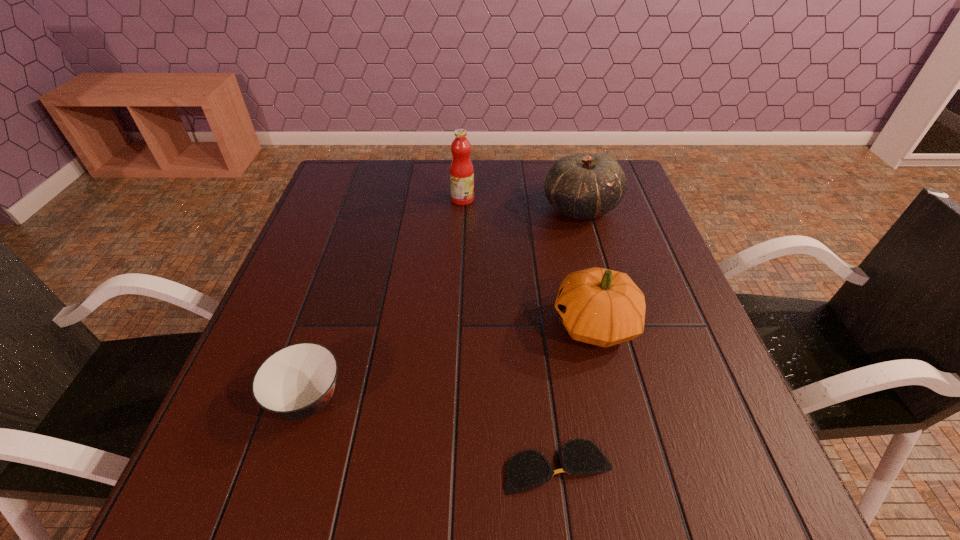
Identify the location of the fourth object from right to left. (461, 170).

Locate an element on the screen. This screenshot has width=960, height=540. fruit juice is located at coordinates (461, 170).

Where is `the farther gourd`? the farther gourd is located at coordinates (584, 186).

Locate an element on the screen. This screenshot has height=540, width=960. the nearer gourd is located at coordinates (598, 306).

What are the coordinates of `the fourth tallest object` in the screenshot? It's located at (297, 381).

The height and width of the screenshot is (540, 960). Identify the location of the second nearest object. click(x=297, y=381).

The height and width of the screenshot is (540, 960). Identify the location of spectacles. (527, 469).

Identify the location of the shortest object. This screenshot has width=960, height=540. (527, 469).

You are a GUI agent. You are given a task and a screenshot of the screen. Output one action in this format:
    pyautogui.click(x=<x>, y=<y>)
    Task: Click on the free space located 0.150m on the front label of the fruit juice
    
    Given the screenshot: What is the action you would take?
    pyautogui.click(x=526, y=199)

Where is `vacant region located on the back of the farther gourd`? The height and width of the screenshot is (540, 960). vacant region located on the back of the farther gourd is located at coordinates (572, 177).